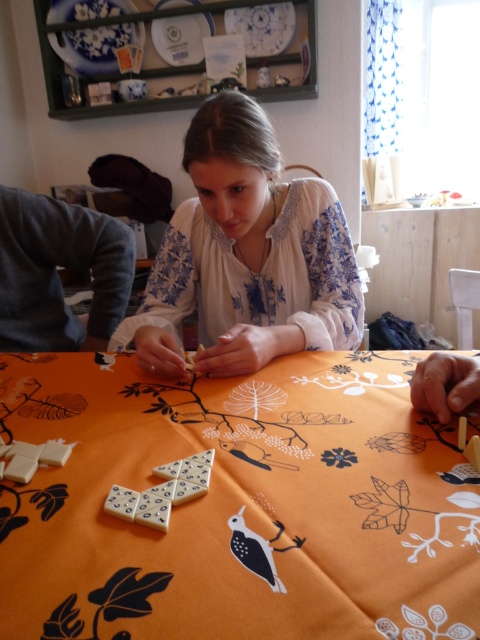
Question: Which of the following is the closest to the observer?

Choices:
 (A) white embroidered blouse at center
 (B) smooth wooden hand at lower right
 (C) white matte dominoes at center

Answer: (C)

Question: Does white embroidered blouse at center have a larger size compared to white matte dominoes at center?

Choices:
 (A) no
 (B) yes

Answer: (B)

Question: In this image, where is white embroidered blouse at center located relative to gray sweater at left?

Choices:
 (A) below
 (B) above

Answer: (B)

Question: Which is nearer to the white embroidered blouse at center?

Choices:
 (A) white matte dominoes at center
 (B) gray sweater at left
 (C) orange fabric at center
 (D) smooth wooden hand at lower right

Answer: (C)

Question: Does orange fabric at center appear on the left side of white matte dominoes at center?

Choices:
 (A) yes
 (B) no

Answer: (B)

Question: Which point is farther to the camera?

Choices:
 (A) orange fabric at center
 (B) white matte dominoes at center

Answer: (B)